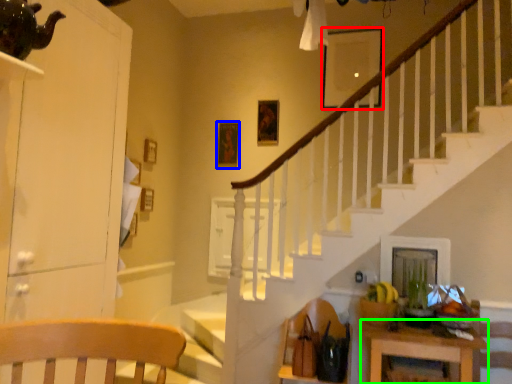
Question: Estimate the real-world distances between objects in this image. Which object is farther from picture frame (highlighted by a red box), picture frame (highlighted by a blue box) or table (highlighted by a green box)?

Choices:
 (A) picture frame
 (B) table

Answer: (B)